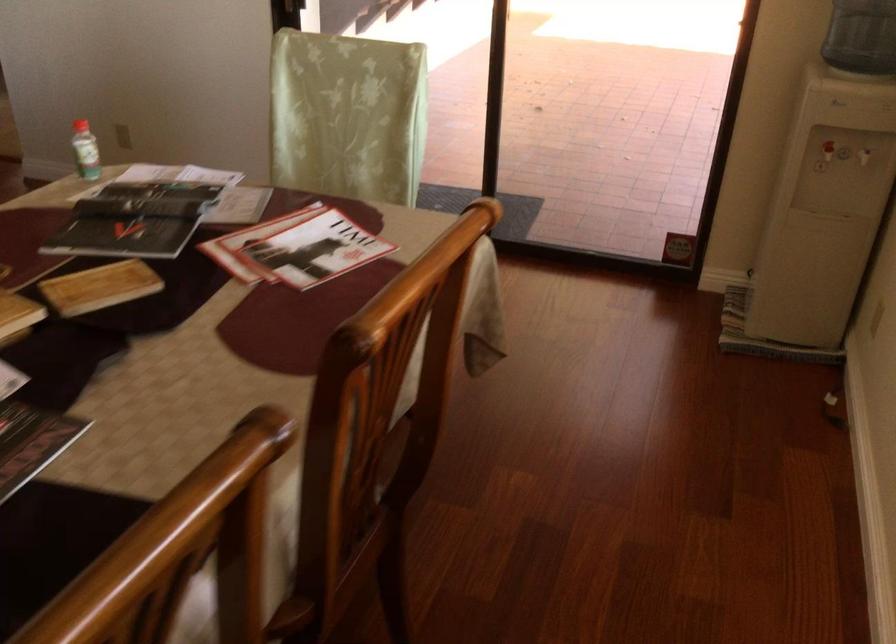
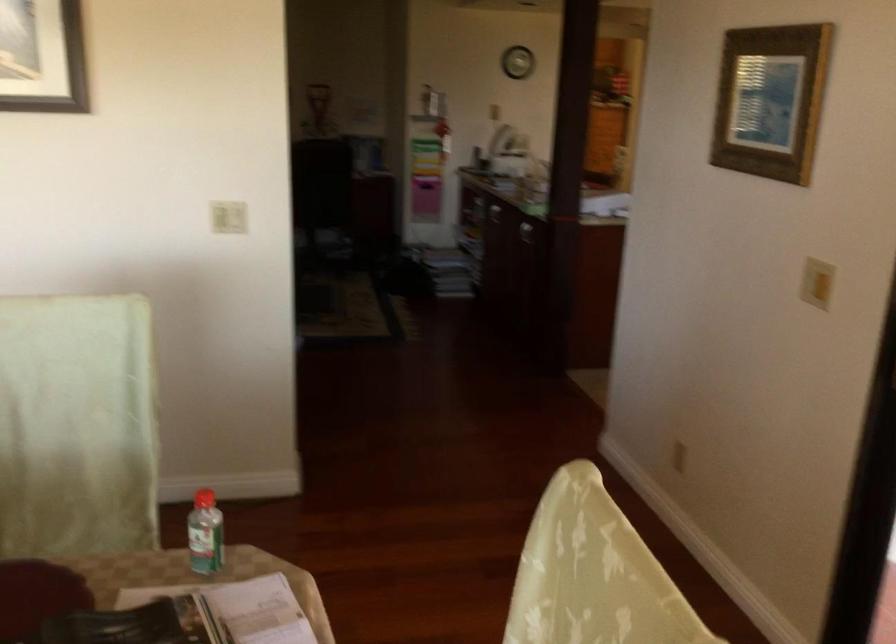
The point at (x=140, y=176) is marked in the first image. Where is the corresponding point in the second image?

(238, 609)